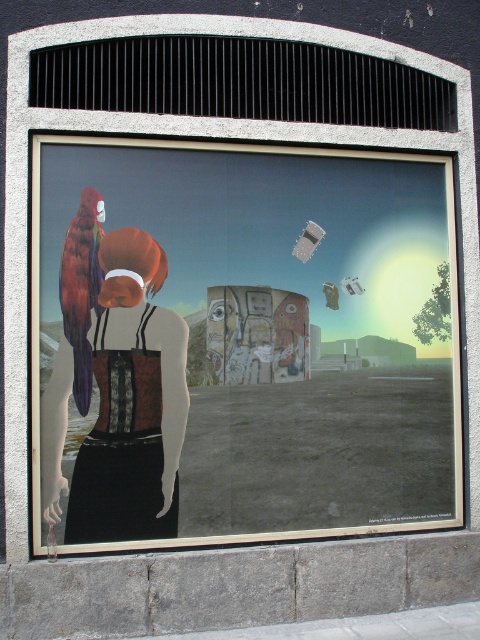
Question: Which object is positioned farthest from the shiny metallic parrot at left?

Choices:
 (A) matte black poster at center
 (B) wooden painted mask at center
 (C) matte black corset at center

Answer: (B)

Question: Does matte black poster at center appear on the right side of wooden painted mask at center?

Choices:
 (A) no
 (B) yes

Answer: (A)

Question: Does matte black corset at center appear over shiny metallic parrot at left?

Choices:
 (A) no
 (B) yes

Answer: (A)

Question: Which object is positioned farthest from the shiny metallic parrot at left?

Choices:
 (A) wooden painted mask at center
 (B) matte black poster at center
 (C) matte black corset at center

Answer: (A)

Question: Can you confirm if matte black poster at center is positioned to the right of wooden painted mask at center?

Choices:
 (A) no
 (B) yes

Answer: (A)

Question: Among these points, which one is farthest from the camera?

Choices:
 (A) (112, 147)
 (B) (80, 298)

Answer: (A)